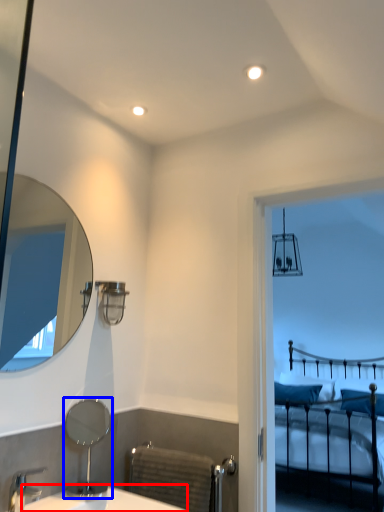
Question: Which object is further to the camera taking this photo, counter top (highlighted by a red box) or mirror (highlighted by a blue box)?

Choices:
 (A) counter top
 (B) mirror

Answer: (B)